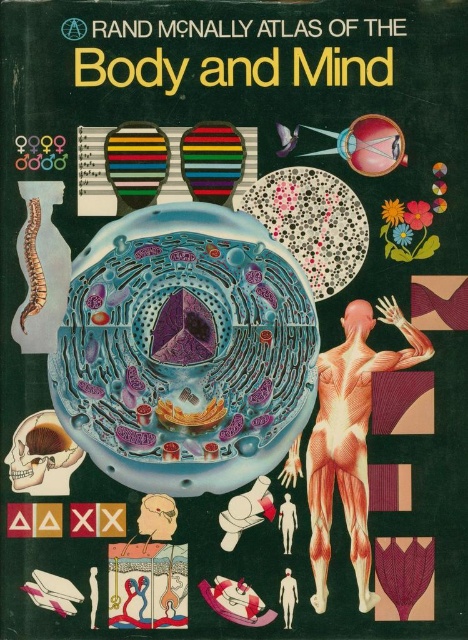
You are a medical student examining the cover of the Rand McNally Atlas of the Body and Mind. You notice the muscular flesh at center and the smooth human figure at center. Which object is positioned in front of the other?

The muscular flesh at center is closer to the viewer than the smooth human figure at center, so it is positioned in front of it.

Based on the scene described, which object is positioned higher up in the image? The muscular flesh at center or the smooth orange human figure at center?

The muscular flesh at center is positioned above the smooth orange human figure at center.